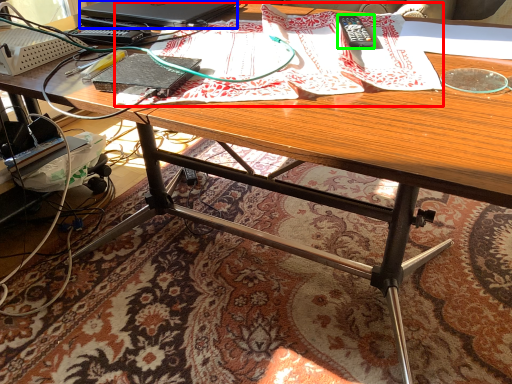
Question: Considering the real-world distances, which object is farthest from wrapping paper (highlighted by a red box)? laptop (highlighted by a blue box) or remote control (highlighted by a green box)?

Choices:
 (A) laptop
 (B) remote control

Answer: (A)